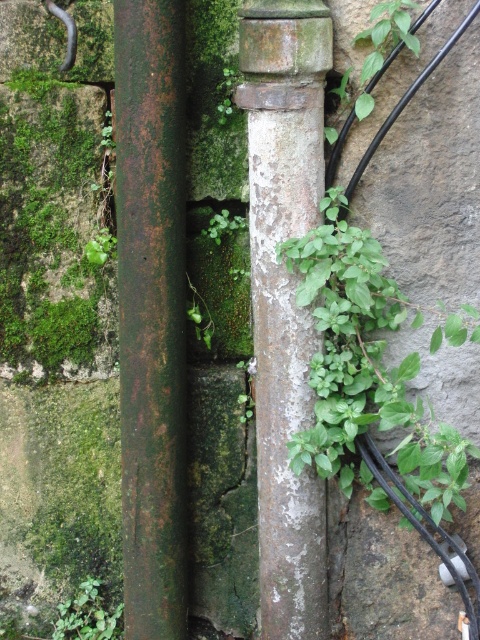
Who is taller, rusty metal pole at left or green leafy plant at center right?

rusty metal pole at left is taller.

Does point (156, 483) come closer to viewer compared to point (444, 332)?

Yes.

What do you see at coordinates (152, 312) in the screenshot?
I see `rusty metal pole at left` at bounding box center [152, 312].

Identify the location of rusty metal pole at left. (152, 312).

Looking at this image, can you confirm if rusty metal pole at center is taller than green leafy plant at center right?

Indeed, rusty metal pole at center has a greater height compared to green leafy plant at center right.

Which is above, rusty metal pole at center or green leafy plant at center right?

rusty metal pole at center

Where is `rusty metal pole at center`? This screenshot has height=640, width=480. rusty metal pole at center is located at coordinates (285, 296).

Where is `rusty metal pole at center`? rusty metal pole at center is located at coordinates (285, 296).

Is rusty metal pole at left above rusty metal pole at center?

Yes.

Between point (152, 493) and point (255, 132), which one is positioned behind?

Positioned behind is point (152, 493).

Does point (130, 616) come behind point (254, 60)?

Yes, it is.

You are a GUI agent. You are given a task and a screenshot of the screen. Output one action in this format:
    pyautogui.click(x=<x>, y=<y>)
    Task: Click on the rusty metal pole at left
    The image size is (480, 640).
    Given the screenshot: What is the action you would take?
    pyautogui.click(x=152, y=312)